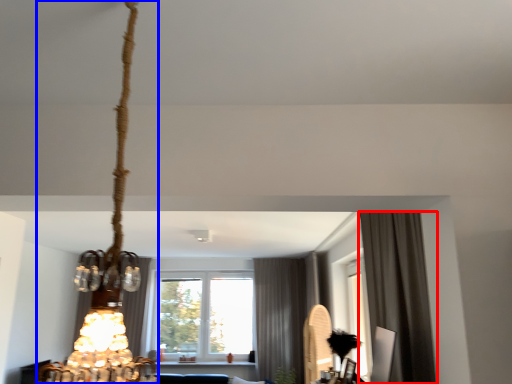
Question: Which point is further to the camera, curtain (highlighted by a red box) or lamp (highlighted by a blue box)?

Choices:
 (A) curtain
 (B) lamp

Answer: (A)